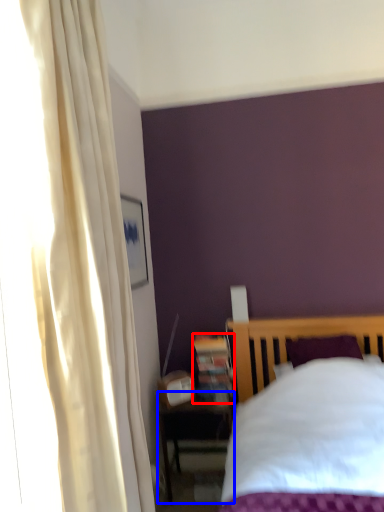
Question: Which object is further to the camera taking this photo, bookshelf (highlighted by a red box) or nightstand (highlighted by a blue box)?

Choices:
 (A) bookshelf
 (B) nightstand

Answer: (A)